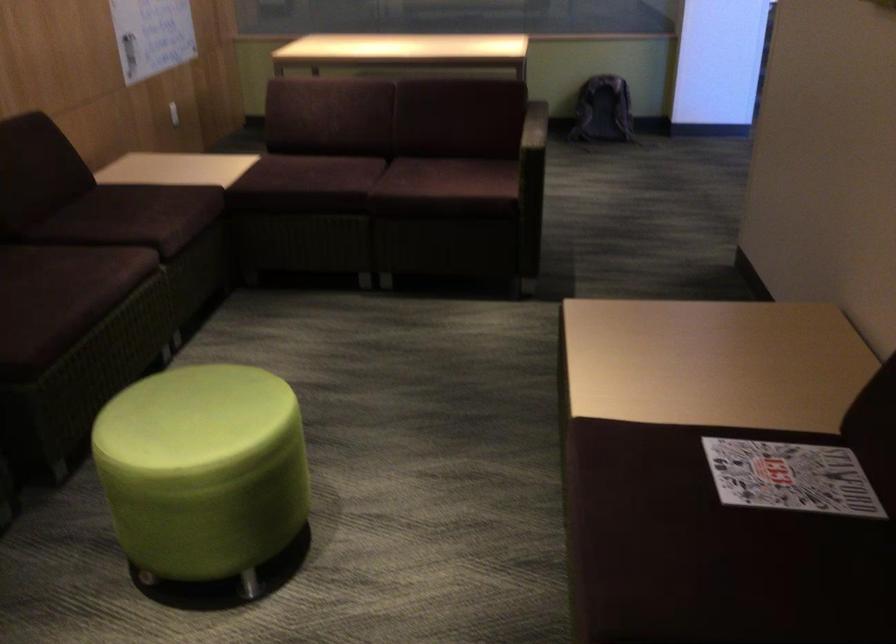
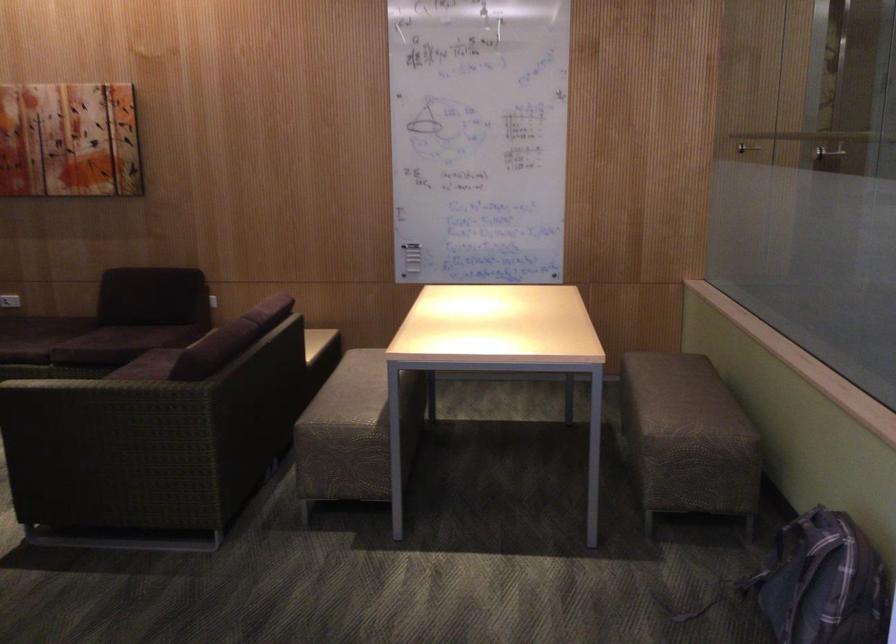
In the second image, find the point that corresponds to (x=78, y=205) in the first image.

(123, 322)